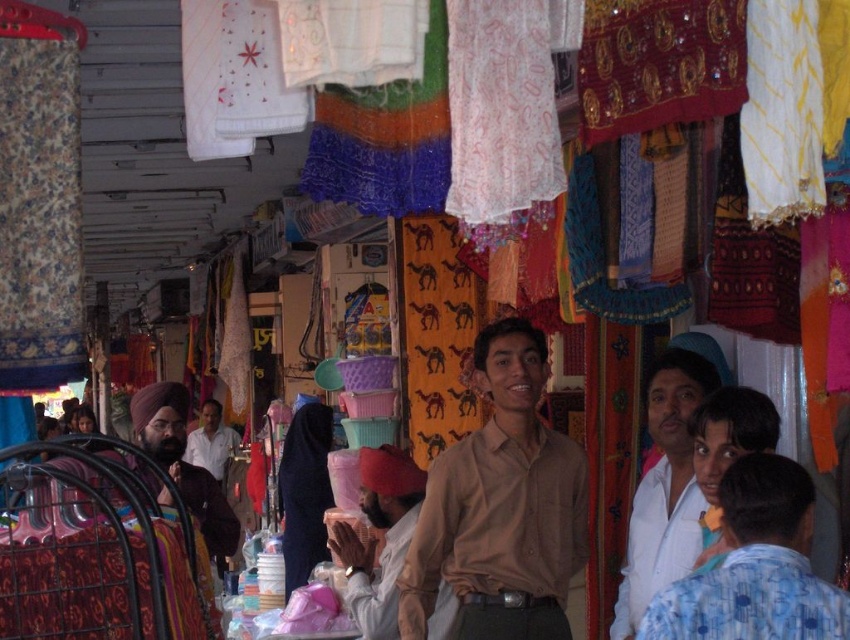
You are a customer in the market and want to greet both the person wearing the matte brown turban at left and the person wearing the light brown shirt at center. Which one should you approach first if you are standing at the entrance facing the textiles?

You should approach the matte brown turban at left first because it is positioned to the right of the light brown shirt at center, meaning it is closer to your right side when facing the textiles.